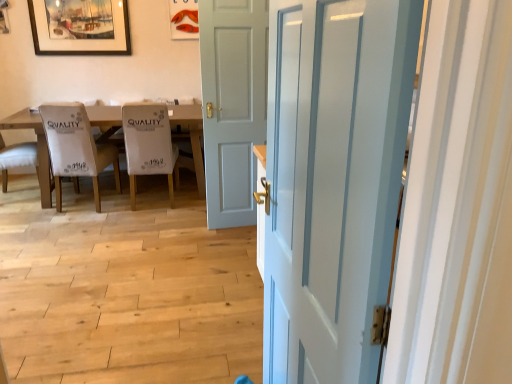
Question: From their relative heights in the image, would you say wooden framed painting at upper left is taller or shorter than wooden table at left?

Choices:
 (A) short
 (B) tall

Answer: (A)

Question: In the image, is wooden framed painting at upper left positioned in front of or behind wooden table at left?

Choices:
 (A) front
 (B) behind

Answer: (B)

Question: Which object is positioned closest to the wooden framed painting at upper left?

Choices:
 (A) white glossy door at center, which appears as the first door when viewed from the right
 (B) white fabric chair at left, the 2th chair viewed from the right
 (C) wooden table at left
 (D) white fabric chair at left, the 3th chair from the right
 (E) white fabric chair at center, placed as the 3th chair when sorted from left to right

Answer: (B)

Question: Considering the real-world distances, which object is closest to the wooden framed painting at upper left?

Choices:
 (A) white fabric chair at left, the 2th chair viewed from the right
 (B) white fabric chair at left, which is the first chair in left-to-right order
 (C) wooden table at left
 (D) light gray wood door at center, which is the 2th door from right to left
 (E) white fabric chair at center, placed as the 3th chair when sorted from left to right

Answer: (A)